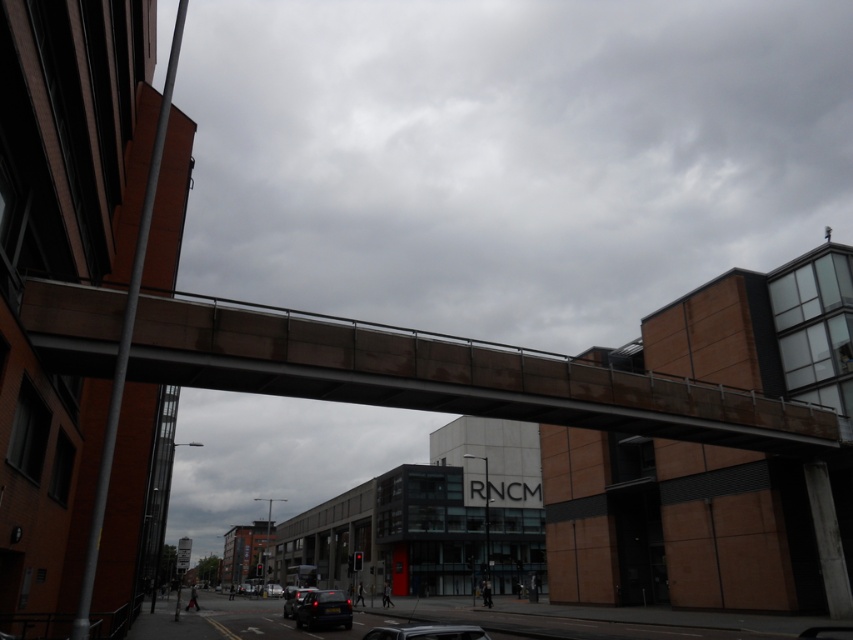
Question: Which of these objects is positioned farthest from the shiny black car at lower center?

Choices:
 (A) matte black car at lower center
 (B) metallic silver car at center

Answer: (B)

Question: Among these points, which one is nearest to the camera?

Choices:
 (A) (372, 632)
 (B) (645, 397)
 (C) (296, 609)

Answer: (A)

Question: Which point is closer to the camera?

Choices:
 (A) matte black car at lower center
 (B) metallic silver car at center
 (C) shiny black car at lower center
 (D) brown concrete bridge at center

Answer: (B)

Question: In this image, where is brown concrete bridge at center located relative to shiny black car at lower center?

Choices:
 (A) left
 (B) right

Answer: (B)

Question: Does metallic silver car at center have a lesser width compared to shiny black car at lower center?

Choices:
 (A) yes
 (B) no

Answer: (A)

Question: Is matte black car at lower center bigger than shiny black car at lower center?

Choices:
 (A) no
 (B) yes

Answer: (B)